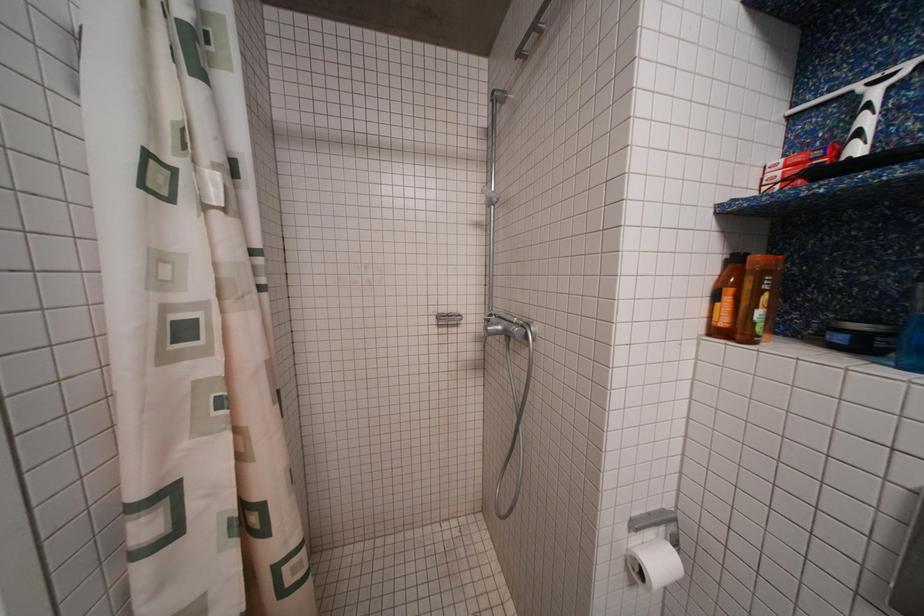
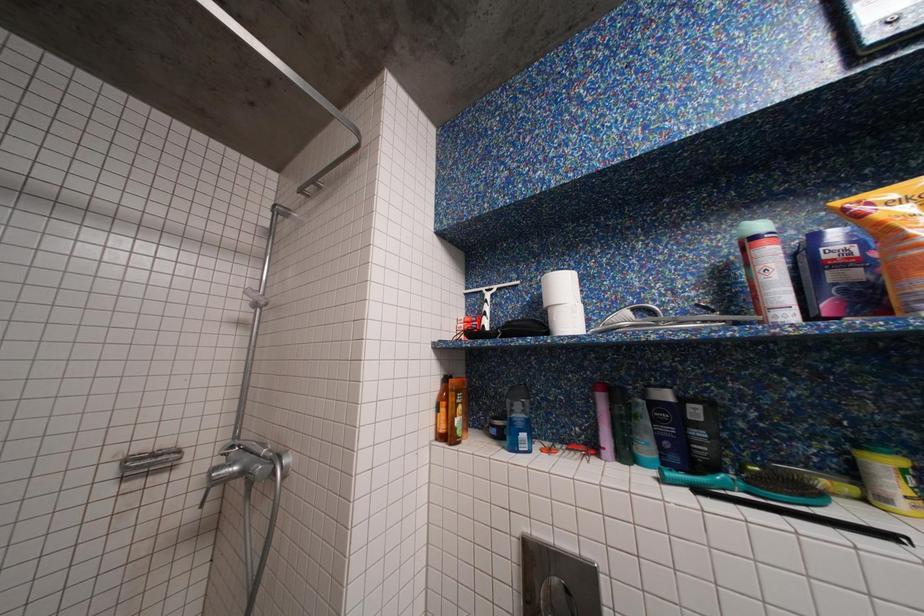
First-person continuous shooting, in which direction is the camera rotating?

The rotation direction of the camera is right-up.